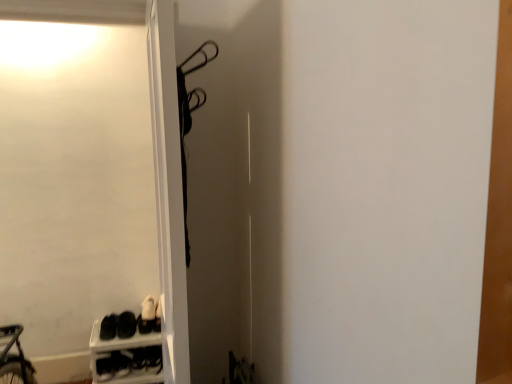
Question: From a real-world perspective, is black matte sneakers at lower left, which is the second footwear from left to right, over black matte shoes at lower left, the first footwear in the left-to-right sequence?

Choices:
 (A) yes
 (B) no

Answer: (A)

Question: Is black matte sneakers at lower left, arranged as the 2th footwear when viewed from the right, shorter than black matte shoes at lower left, the first footwear in the left-to-right sequence?

Choices:
 (A) no
 (B) yes

Answer: (B)

Question: Is black matte sneakers at lower left, arranged as the 2th footwear when viewed from the right, facing towards black matte shoes at lower left, the 3th footwear when ordered from right to left?

Choices:
 (A) yes
 (B) no

Answer: (B)

Question: Does black matte sneakers at lower left, arranged as the 2th footwear when viewed from the right, lie in front of black matte shoes at lower left, the 3th footwear when ordered from right to left?

Choices:
 (A) yes
 (B) no

Answer: (B)

Question: Is black matte sneakers at lower left, which is the second footwear from left to right, with black matte shoes at lower left, the 3th footwear when ordered from right to left?

Choices:
 (A) no
 (B) yes

Answer: (B)

Question: From a real-world perspective, is black matte sneakers at lower left, arranged as the 2th footwear when viewed from the right, physically located above or below white plastic shoe rack at lower left?

Choices:
 (A) above
 (B) below

Answer: (A)

Question: Would you say black matte sneakers at lower left, which is the second footwear from left to right, is to the left or to the right of white plastic shoe rack at lower left in the picture?

Choices:
 (A) right
 (B) left

Answer: (B)

Question: Is black matte sneakers at lower left, arranged as the 2th footwear when viewed from the right, situated inside white plastic shoe rack at lower left or outside?

Choices:
 (A) inside
 (B) outside

Answer: (B)

Question: Considering the positions of point (135, 327) and point (91, 354), is point (135, 327) closer or farther from the camera than point (91, 354)?

Choices:
 (A) closer
 (B) farther

Answer: (A)

Question: In terms of width, does white plastic shoe rack at lower left look wider or thinner when compared to white leather shoe at lower left?

Choices:
 (A) thin
 (B) wide

Answer: (B)

Question: Considering their positions, is white plastic shoe rack at lower left located in front of or behind white leather shoe at lower left?

Choices:
 (A) front
 (B) behind

Answer: (A)

Question: Is point (95, 357) positioned closer to the camera than point (147, 354)?

Choices:
 (A) closer
 (B) farther

Answer: (B)

Question: From a real-world perspective, relative to white leather shoe at lower left, is white plastic shoe rack at lower left vertically above or below?

Choices:
 (A) below
 (B) above

Answer: (B)

Question: Considering the positions of black matte sneakers at lower left, the third footwear positioned from the left, and white leather shoe at lower left in the image, is black matte sneakers at lower left, the third footwear positioned from the left, taller or shorter than white leather shoe at lower left?

Choices:
 (A) short
 (B) tall

Answer: (B)

Question: From a real-world perspective, is black matte sneakers at lower left, which is the first footwear from right to left, positioned above or below white leather shoe at lower left?

Choices:
 (A) above
 (B) below

Answer: (A)